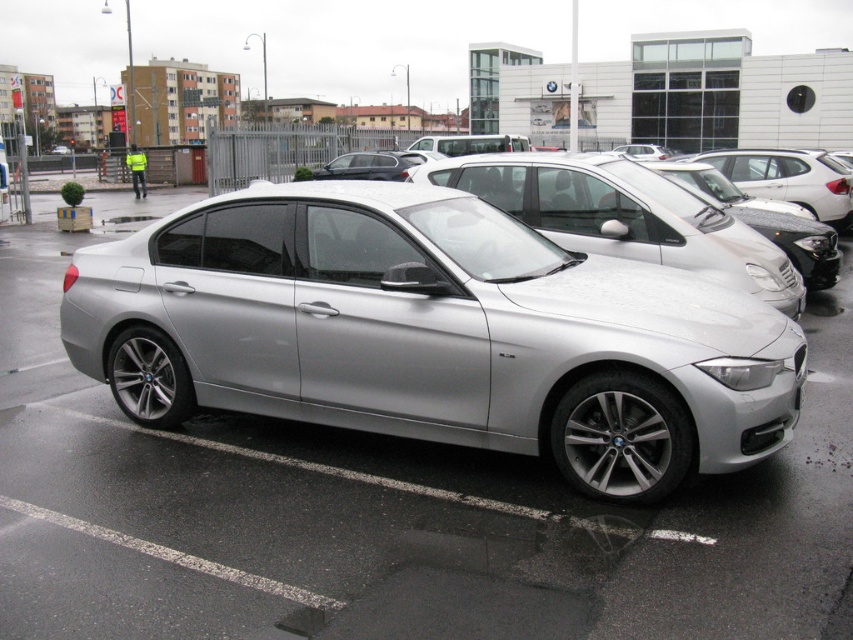
Does satin silver car at center have a smaller size compared to satin silver sedan at center?

Indeed, satin silver car at center has a smaller size compared to satin silver sedan at center.

Which of these two, satin silver car at center or satin silver sedan at center, stands taller?

→ Standing taller between the two is satin silver sedan at center.

Where is `satin silver car at center`? The image size is (853, 640). satin silver car at center is located at coordinates (624, 216).